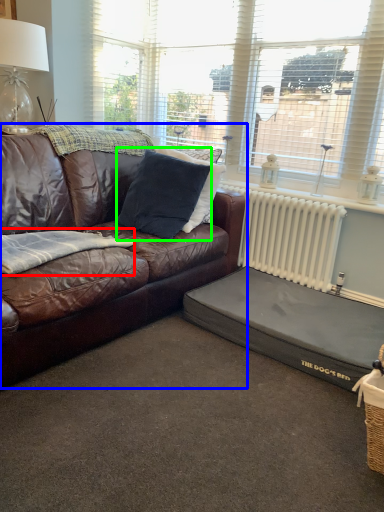
Question: Which object is the closest to the blanket (highlighted by a red box)? Choose among these: studio couch (highlighted by a blue box) or pillow (highlighted by a green box).

Choices:
 (A) studio couch
 (B) pillow

Answer: (A)